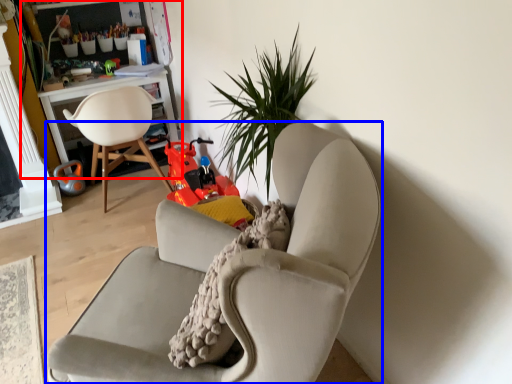
Question: Among these objects, which one is nearest to the camera, bookshelf (highlighted by a red box) or chair (highlighted by a blue box)?

Choices:
 (A) bookshelf
 (B) chair

Answer: (B)